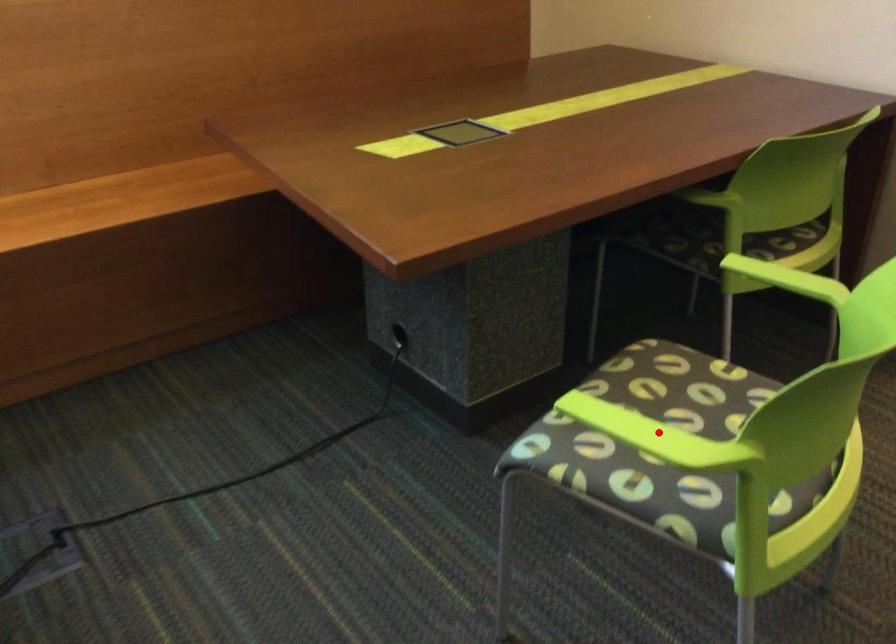
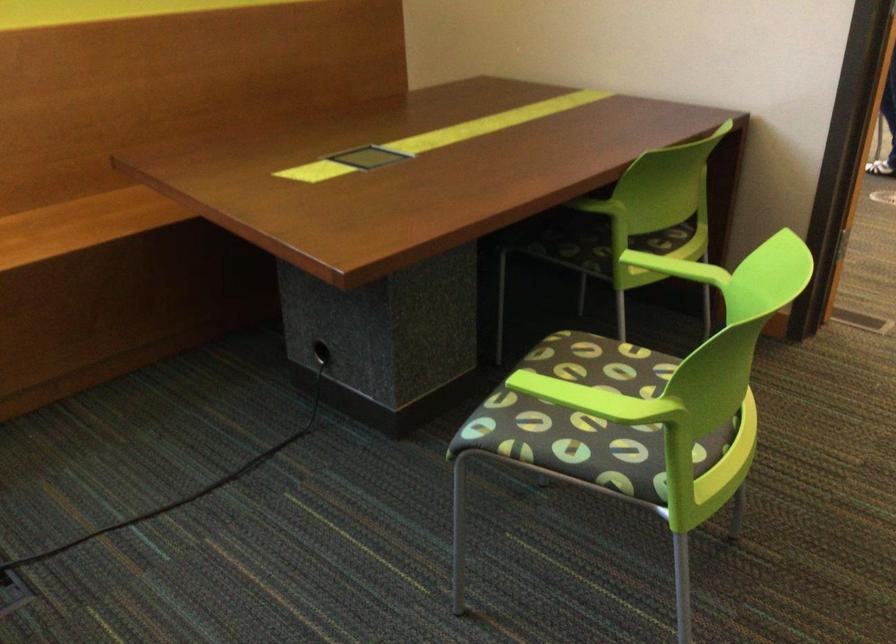
The point at the highlighted location is marked in the first image. Where is the corresponding point in the second image?

(599, 399)